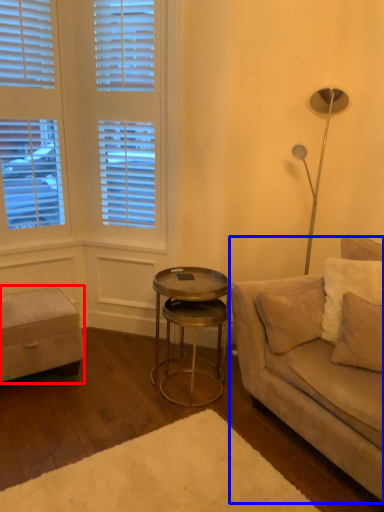
Question: Which point is closer to the camera, music stool (highlighted by a red box) or studio couch (highlighted by a blue box)?

Choices:
 (A) music stool
 (B) studio couch

Answer: (B)